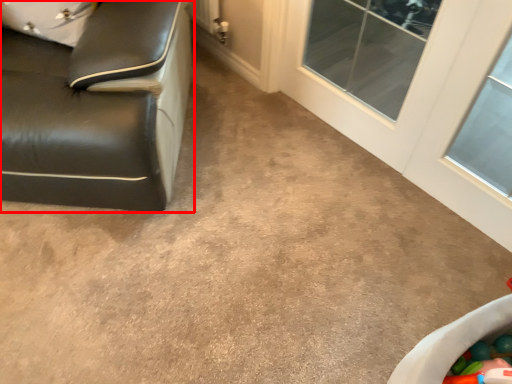
Question: Where is furniture (annotated by the red box) located in relation to glass door in the image?

Choices:
 (A) left
 (B) right

Answer: (A)